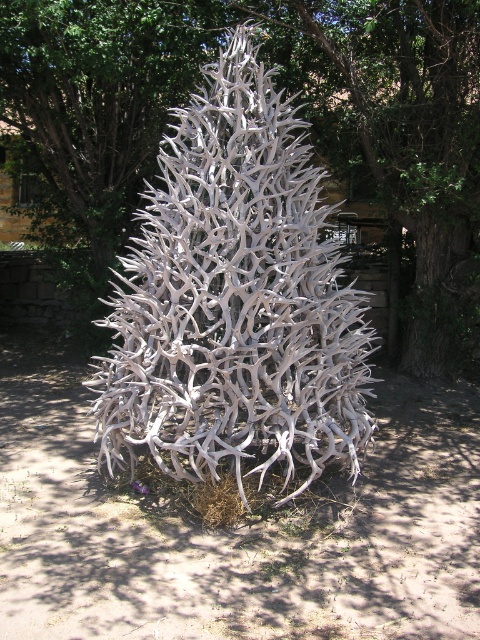
Who is shorter, white antler christmas tree at center or white antler at center?

white antler at center

The height and width of the screenshot is (640, 480). What are the coordinates of `white antler christmas tree at center` in the screenshot? It's located at (235, 301).

The image size is (480, 640). Identify the location of white antler christmas tree at center. (235, 301).